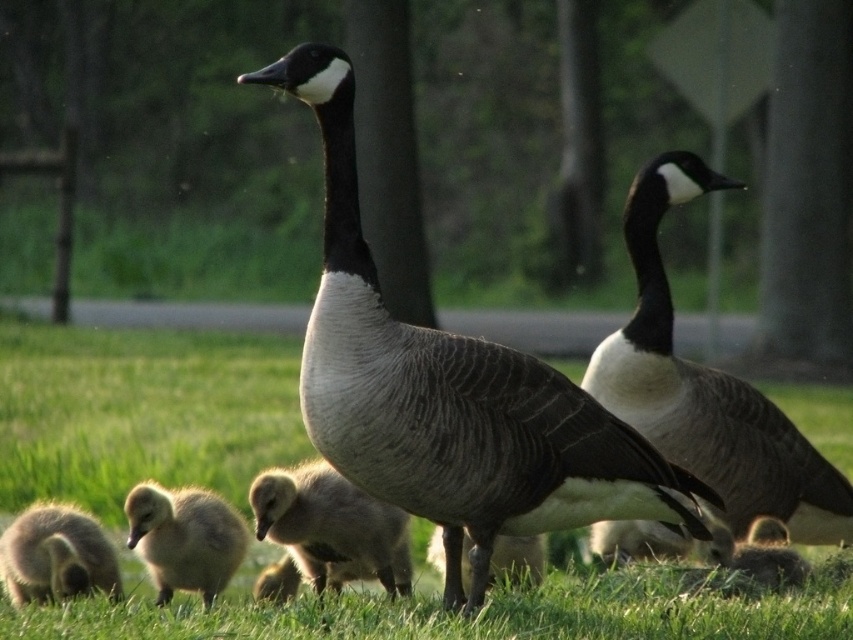
Question: Which of the following is the closest to the observer?

Choices:
 (A) (479, 378)
 (B) (276, 470)
 (C) (129, 548)
 (D) (293, 410)

Answer: (A)

Question: Which of the following is the closest to the observer?

Choices:
 (A) (672, 625)
 (B) (218, 502)
 (C) (587, 579)
 (D) (262, 493)

Answer: (A)

Question: Which point is closer to the camera?

Choices:
 (A) (67, 588)
 (B) (54, 397)
 (C) (151, 497)

Answer: (C)

Question: Is matte gray goose at center to the right of soft gray downy duckling at lower left from the viewer's perspective?

Choices:
 (A) no
 (B) yes

Answer: (B)

Question: Is soft gray downy duckling at center smaller than soft brown duckling at lower right?

Choices:
 (A) yes
 (B) no

Answer: (B)

Question: Is dark gray feathered goose at center smaller than matte gray goose at center?

Choices:
 (A) no
 (B) yes

Answer: (A)